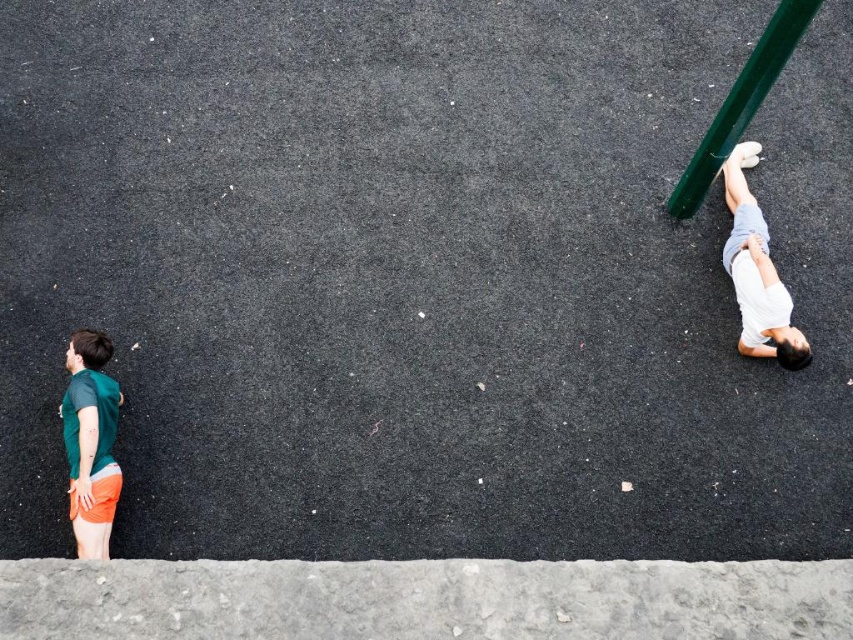
What do you see at coordinates (90, 442) in the screenshot?
I see `green matte shorts at left` at bounding box center [90, 442].

Is point (77, 476) positioned behind point (782, 35)?

Yes, point (77, 476) is farther from viewer.

I want to click on green matte shorts at left, so click(90, 442).

Who is taller, green matte shorts at left or white cotton shorts at right?

With more height is white cotton shorts at right.

In the scene shown: Does green matte shorts at left have a greater height compared to white cotton shorts at right?

In fact, green matte shorts at left may be shorter than white cotton shorts at right.

Where is `green matte shorts at left`? green matte shorts at left is located at coordinates (90, 442).

Is point (762, 278) more distant than point (779, 29)?

Yes, it is.

Does white cotton shorts at right appear under green metallic pole at upper right?

Correct, white cotton shorts at right is located below green metallic pole at upper right.

Measure the distance between white cotton shorts at right and camera.

5.68 meters

Locate an element on the screen. white cotton shorts at right is located at coordinates (757, 273).